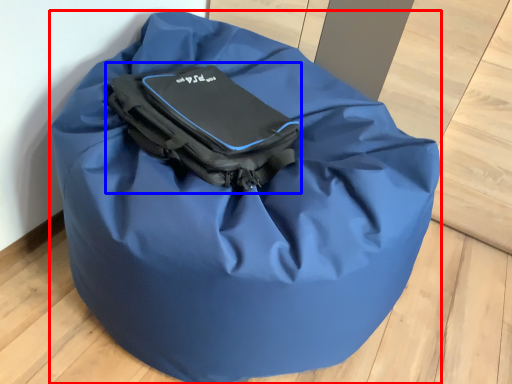
Question: Which object appears closest to the camera in this image, luggage and bags (highlighted by a red box) or pack (highlighted by a blue box)?

Choices:
 (A) luggage and bags
 (B) pack

Answer: (A)